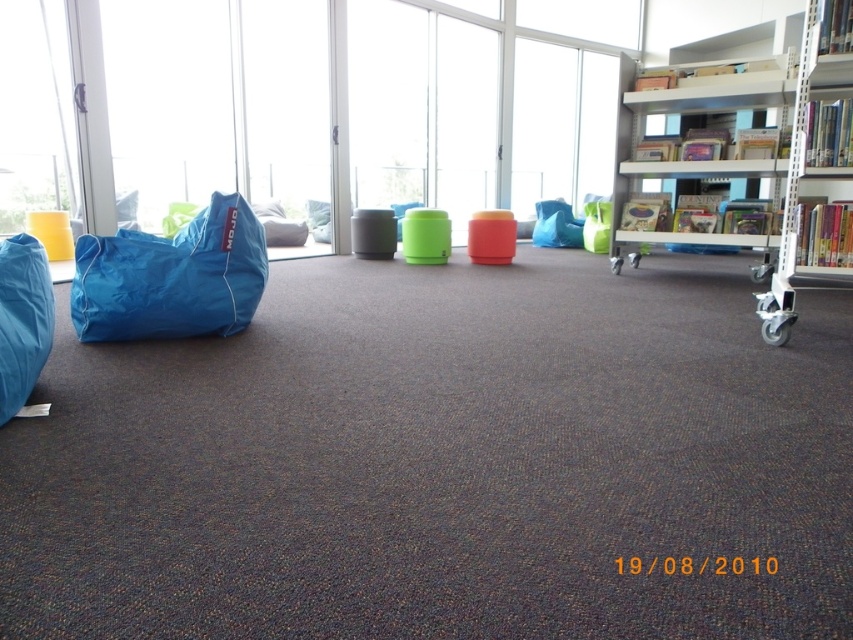
Question: Can you confirm if blue fabric beanbag at left is positioned to the right of white plastic shelf at right?

Choices:
 (A) yes
 (B) no

Answer: (B)

Question: Does transparent glass window at center appear on the right side of blue fabric beanbag at left?

Choices:
 (A) no
 (B) yes

Answer: (A)

Question: Which object appears closest to the camera in this image?

Choices:
 (A) transparent glass window at center
 (B) white plastic shelf at right

Answer: (B)

Question: Considering the relative positions of transparent glass window at center and white metal shelf at upper right in the image provided, where is transparent glass window at center located with respect to white metal shelf at upper right?

Choices:
 (A) left
 (B) right

Answer: (A)

Question: Which point appears farthest from the camera in this image?

Choices:
 (A) (802, 77)
 (B) (585, 80)

Answer: (B)

Question: Based on their relative distances, which object is farther from the white plastic shelf at right?

Choices:
 (A) white metal shelf at upper right
 (B) transparent glass window at center

Answer: (B)